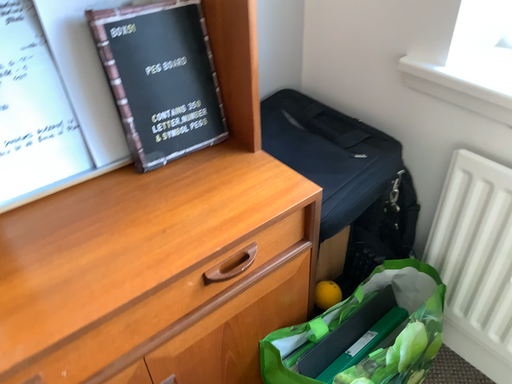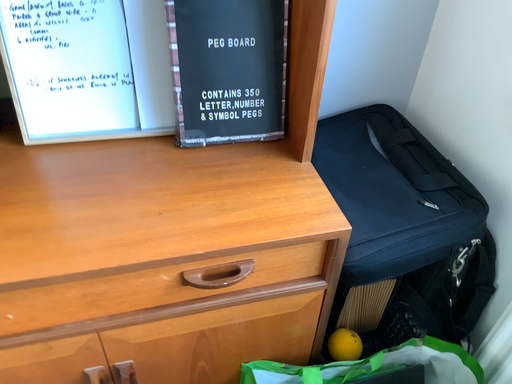
Question: How did the camera likely rotate when shooting the video?

Choices:
 (A) rotated right
 (B) rotated left

Answer: (B)